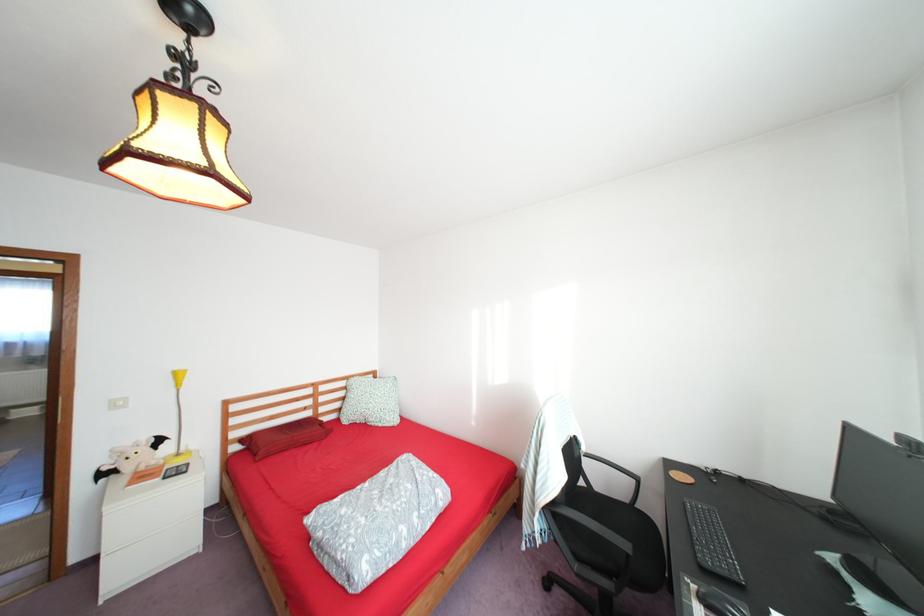
Image resolution: width=924 pixels, height=616 pixels. What do you see at coordinates (117, 403) in the screenshot? I see `the white light switch` at bounding box center [117, 403].